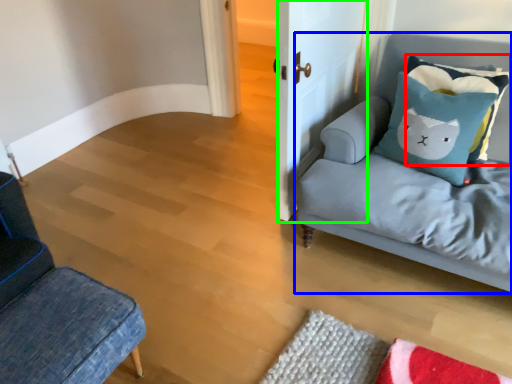
Question: Based on their relative distances, which object is nearer to pillow (highlighted by a red box)? Choose from studio couch (highlighted by a blue box) and door (highlighted by a green box).

Choices:
 (A) studio couch
 (B) door

Answer: (A)